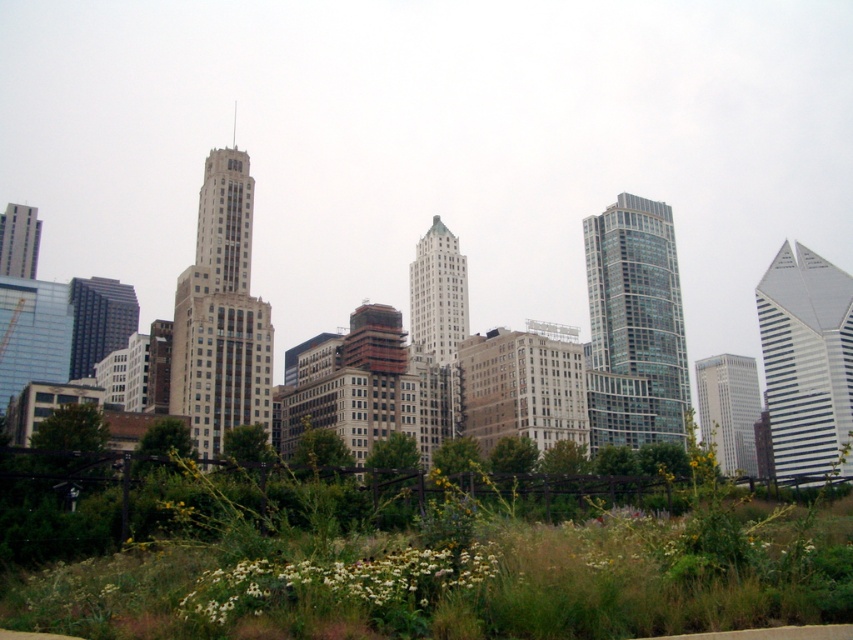
You are a drone operator who needs to deliver a package to a location 30 meters away from the white fluffy flowers at lower center. Based on the scene, can you safely land your drone at the destination without hitting any obstacles?

The white fluffy flowers at lower center and the viewer are 33.59 meters apart. Since the delivery location is 30 meters away from the white fluffy flowers at lower center, it is within the safe distance. However, you must ensure there are no obstacles between the flowers and the landing spot as described in the scene. The scene mentions a lush green area with wildflowers and grasses in the foreground, suggesting open space, so landing should be feasible.